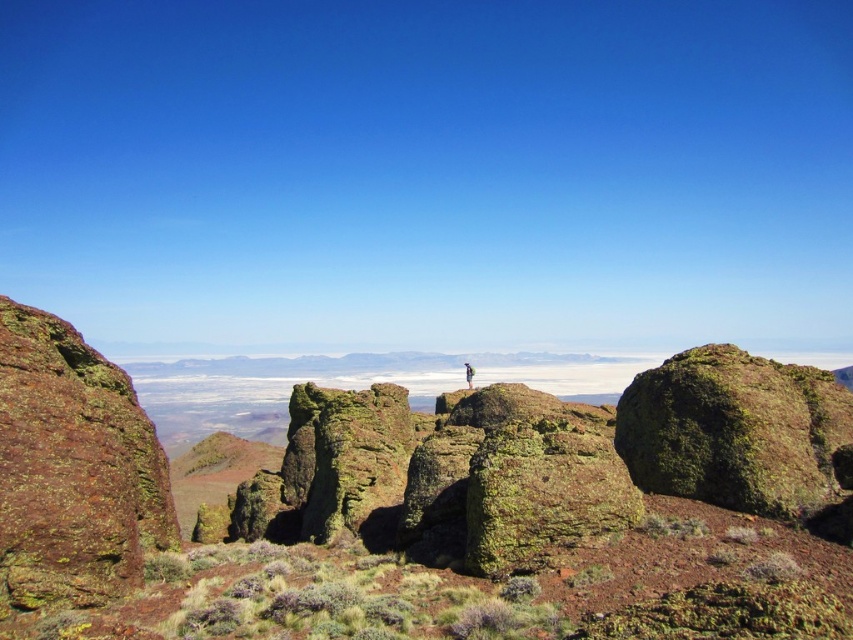
Which is below, green mossy rock at center-right or green textured jacket at center?

green textured jacket at center

Is green mossy rock at center-right behind green textured jacket at center?

No, green mossy rock at center-right is in front of green textured jacket at center.

Which is behind, point (849, 419) or point (468, 381)?

The point (468, 381) is more distant.

At what (x,y) coordinates should I click in order to perform the action: click on green mossy rock at center-right. Please return your answer as a coordinate pair (x, y). Looking at the image, I should click on (734, 429).

Is point (590, 616) farther from viewer compared to point (467, 372)?

No.

Is green mossy rock at center thinner than green textured jacket at center?

In fact, green mossy rock at center might be wider than green textured jacket at center.

Find the location of a particular element. This screenshot has height=640, width=853. green mossy rock at center is located at coordinates (419, 504).

In the scene shown: Who is taller, green mossy rock at center or green mossy rock at center-right?

Standing taller between the two is green mossy rock at center.

Can you confirm if green mossy rock at center is taller than green mossy rock at center-right?

Yes, green mossy rock at center is taller than green mossy rock at center-right.

Is point (94, 589) farther from viewer compared to point (767, 436)?

No, it is not.

Identify the location of green mossy rock at center. The height and width of the screenshot is (640, 853). (419, 504).